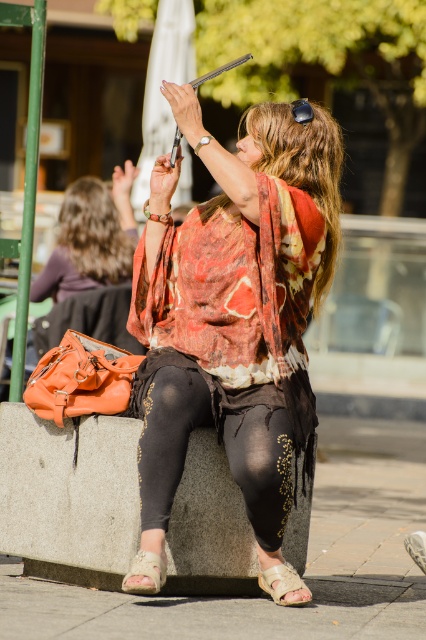
How far apart are black matte leggings at center and black matte goggles at upper center?

A distance of 6.70 feet exists between black matte leggings at center and black matte goggles at upper center.

Can you confirm if black matte leggings at center is positioned above black matte goggles at upper center?

Incorrect, black matte leggings at center is not positioned above black matte goggles at upper center.

This screenshot has height=640, width=426. What do you see at coordinates (219, 438) in the screenshot? I see `black matte leggings at center` at bounding box center [219, 438].

You are a GUI agent. You are given a task and a screenshot of the screen. Output one action in this format:
    pyautogui.click(x=<x>, y=<y>)
    Task: Click on the black matte leggings at center
    
    Given the screenshot: What is the action you would take?
    pyautogui.click(x=219, y=438)

Is matte black phone at upper center thinner than black matte leggings at center?

No, matte black phone at upper center is not thinner than black matte leggings at center.

Is matte black phone at upper center to the right of black matte leggings at center from the viewer's perspective?

Indeed, matte black phone at upper center is positioned on the right side of black matte leggings at center.

Identify the location of matte black phone at upper center. (233, 321).

The width and height of the screenshot is (426, 640). Identify the location of matte black phone at upper center. (233, 321).

The height and width of the screenshot is (640, 426). Find the location of `matte black phone at upper center`. matte black phone at upper center is located at coordinates (233, 321).